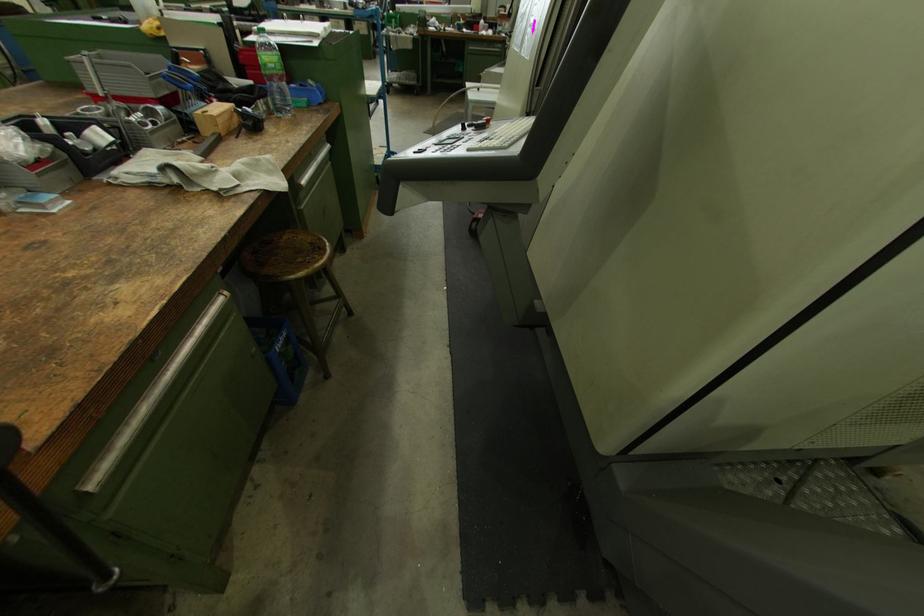
You are a GUI agent. You are given a task and a screenshot of the screen. Output one action in this format:
    pyautogui.click(x=<x>, y=<y>)
    Task: Click on the metal cabinet handle
    The height and width of the screenshot is (616, 924).
    Given the screenshot: What is the action you would take?
    pyautogui.click(x=311, y=168)